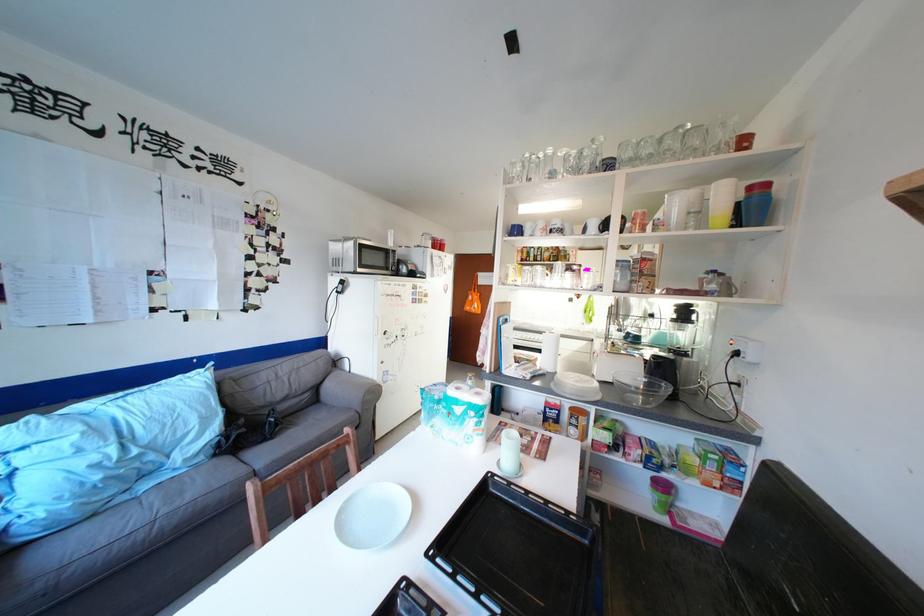
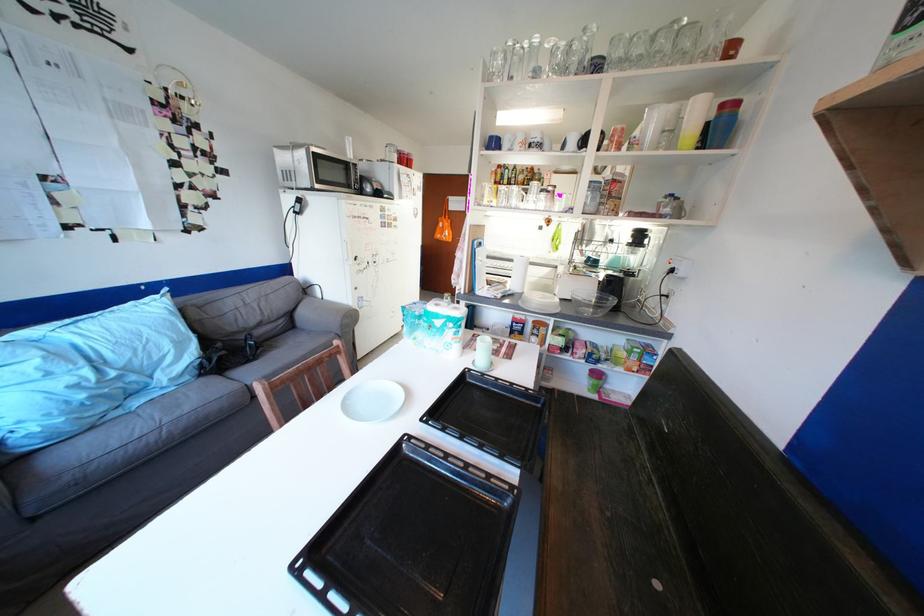
The point at (226, 444) is marked in the first image. Where is the corresponding point in the second image?

(209, 365)